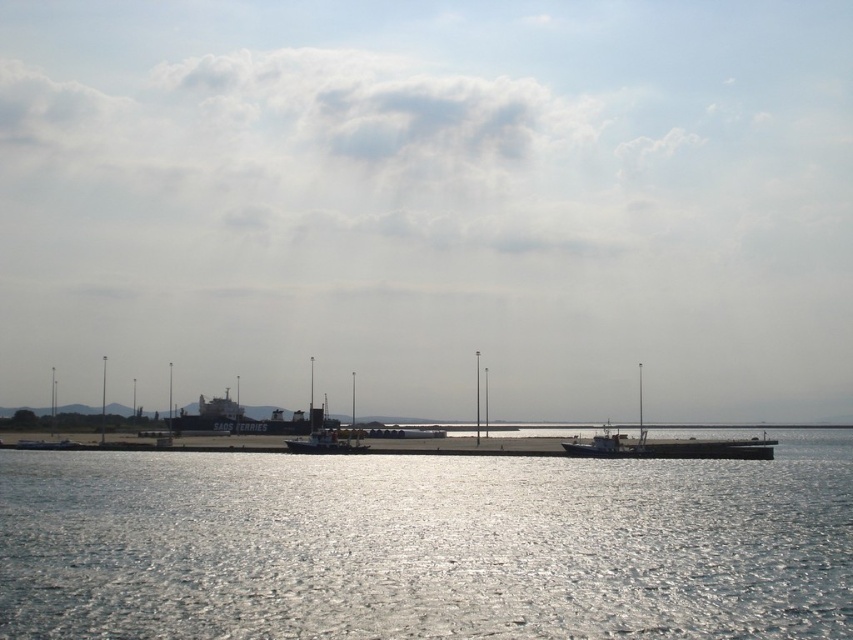
You are a photographer standing on the pier and want to capture both the glistening silver water at center and the metallic gray barge at center in a single shot. Considering their sizes in the frame, which one will appear larger in your photo?

The glistening silver water at center will appear larger in the photo because it is much taller than the metallic gray barge at center according to the description.

Consider the image. You are a photographer trying to capture the metallic gray boat at center in your shot. However, the glistening silver water at center is blocking your view. Can you adjust your position to see the boat?

The glistening silver water at center is positioned over the metallic gray boat at center, so moving your camera angle downward or repositioning yourself to the side might allow you to see the boat beneath the water reflection.

You are standing at the edge of the waterfront scene and want to know the position of the glistening silver water at center relative to your viewpoint. Where is it located?

The glistening silver water at center is located at point 0.853 on the horizontal axis and 0.501 on the vertical axis from your viewpoint.